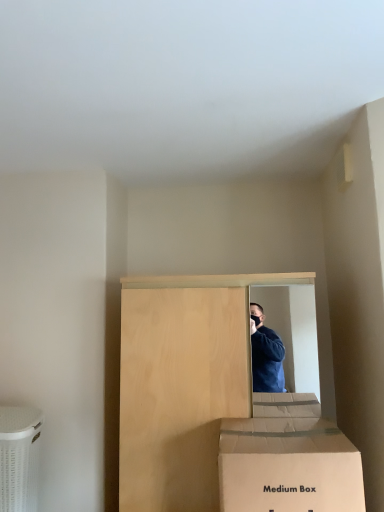
Question: Is bare wood cabinet at center in front of or behind cardboard box at lower left in the image?

Choices:
 (A) front
 (B) behind

Answer: (A)

Question: Is bare wood cabinet at center to the left or to the right of cardboard box at lower left in the image?

Choices:
 (A) right
 (B) left

Answer: (A)

Question: Which of these objects is positioned closest to the cardboard box at lower left?

Choices:
 (A) white cardboard box at lower center
 (B) bare wood cabinet at center

Answer: (B)

Question: Which object is the closest to the cardboard box at lower left?

Choices:
 (A) bare wood cabinet at center
 (B) white cardboard box at lower center

Answer: (A)